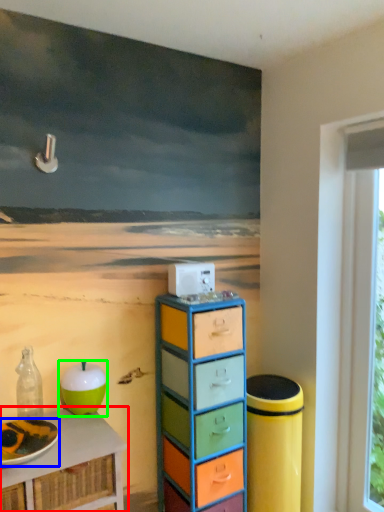
Question: Which is nearer to the table (highlighted by a red box)? plate (highlighted by a blue box) or apple (highlighted by a green box).

Choices:
 (A) plate
 (B) apple

Answer: (A)